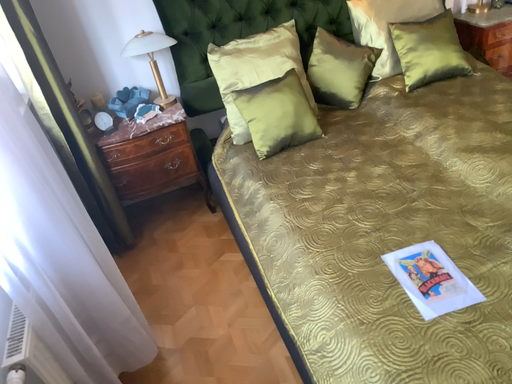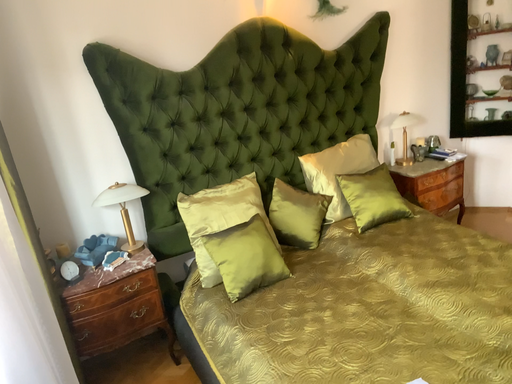
Question: Which way did the camera rotate in the video?

Choices:
 (A) rotated left
 (B) rotated right

Answer: (B)